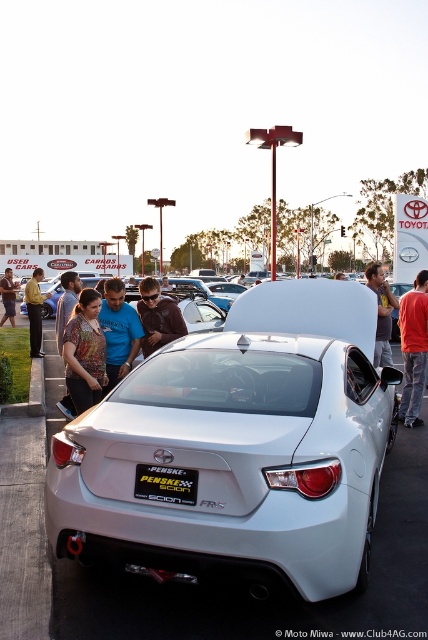
You are a photographer trying to capture a photo of both the matte brown shirt at center and the matte brown leather jacket at center from your current position. Can you fit both objects into your camera frame if your camera has a maximum field of view of 3 meters?

The matte brown shirt at center is 2.65 meters from the matte brown leather jacket at center, so yes, both objects can be captured in the camera frame since the distance between them is within the 3 meter field of view.